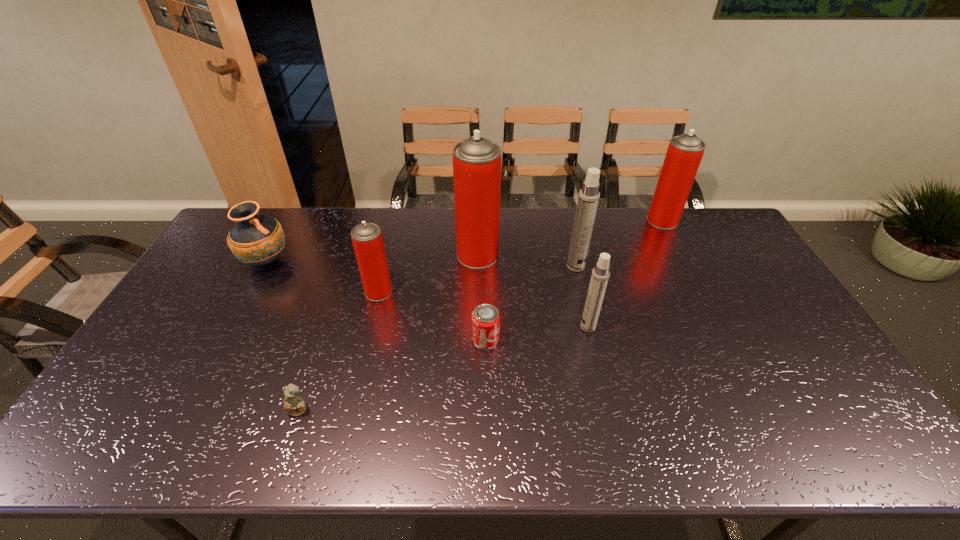
Image resolution: width=960 pixels, height=540 pixels. I want to click on vacant area situated 0.300m on the front of the leftmost object, so click(217, 353).

Where is `vacant space located 0.340m on the right of the red can`? This screenshot has height=540, width=960. vacant space located 0.340m on the right of the red can is located at coordinates (619, 339).

Where is `blank space located 0.080m on the front-facing side of the blue teddy bear`? Image resolution: width=960 pixels, height=540 pixels. blank space located 0.080m on the front-facing side of the blue teddy bear is located at coordinates point(286,449).

Find the location of a particular element. This screenshot has width=960, height=540. pottery present at the far edge is located at coordinates (256, 239).

Image resolution: width=960 pixels, height=540 pixels. In order to click on object at the left edge in this screenshot , I will do `click(256, 239)`.

The width and height of the screenshot is (960, 540). Identify the location of object present at the far left corner. (256, 239).

Image resolution: width=960 pixels, height=540 pixels. In the image, there is a desktop. Find the location of `vacant space at the far edge`. vacant space at the far edge is located at coordinates (674, 232).

The image size is (960, 540). Find the location of `vacant region at the near edge`. vacant region at the near edge is located at coordinates (560, 443).

Identify the location of free space at the left edge. Image resolution: width=960 pixels, height=540 pixels. (181, 343).

Find the location of a particular element. The image size is (960, 540). free location at the right edge is located at coordinates (801, 336).